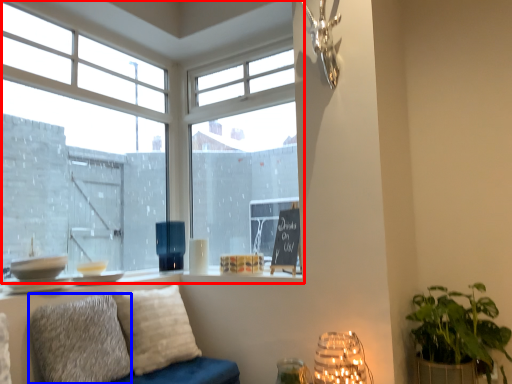
Question: Which object appears closest to the camera in this image, window (highlighted by a red box) or pillow (highlighted by a blue box)?

Choices:
 (A) window
 (B) pillow

Answer: (B)